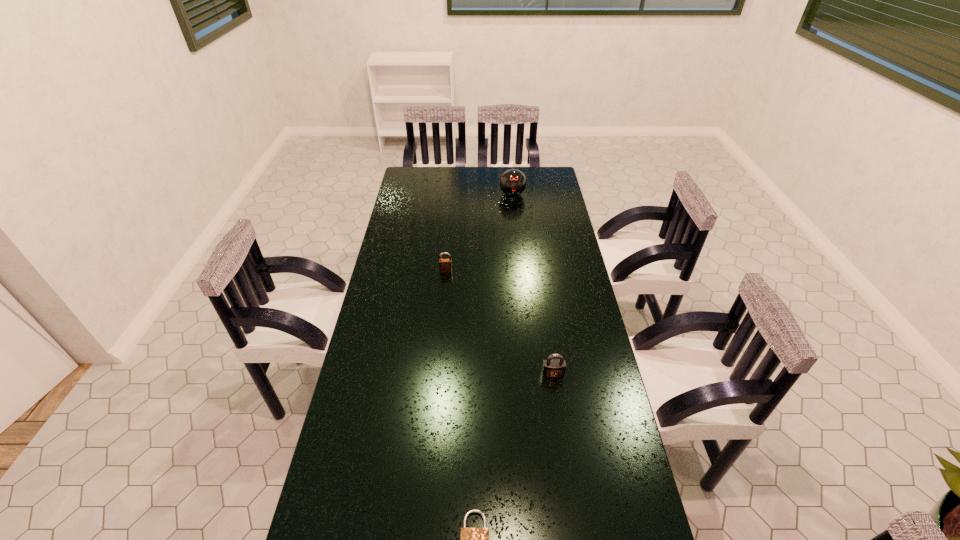
Where is `object that can be found as the closest to the third farthest object`? The width and height of the screenshot is (960, 540). object that can be found as the closest to the third farthest object is located at coordinates (472, 539).

Identify the location of padlock that can be found as the closest to the bowling ball. (445, 265).

The height and width of the screenshot is (540, 960). I want to click on the second closest padlock to the leftmost padlock, so click(472, 539).